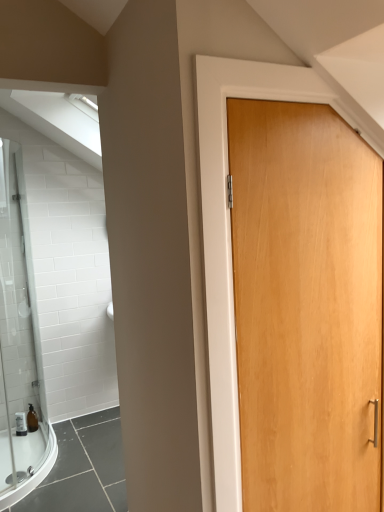
Question: From a real-world perspective, is translucent amber bottle at lower left above or below light brown wood door at center?

Choices:
 (A) above
 (B) below

Answer: (B)

Question: Is translucent amber bottle at lower left bigger or smaller than light brown wood door at center?

Choices:
 (A) big
 (B) small

Answer: (B)

Question: Is translucent amber bottle at lower left in front of or behind light brown wood door at center in the image?

Choices:
 (A) behind
 (B) front

Answer: (A)

Question: Is light brown wood door at center inside the boundaries of translucent amber bottle at lower left, or outside?

Choices:
 (A) outside
 (B) inside

Answer: (A)

Question: Visually, is light brown wood door at center positioned to the left or to the right of translucent amber bottle at lower left?

Choices:
 (A) right
 (B) left

Answer: (A)

Question: Considering the positions of point (251, 330) and point (31, 415), is point (251, 330) closer or farther from the camera than point (31, 415)?

Choices:
 (A) closer
 (B) farther

Answer: (A)

Question: From a real-world perspective, is light brown wood door at center physically located above or below translucent amber bottle at lower left?

Choices:
 (A) below
 (B) above

Answer: (B)